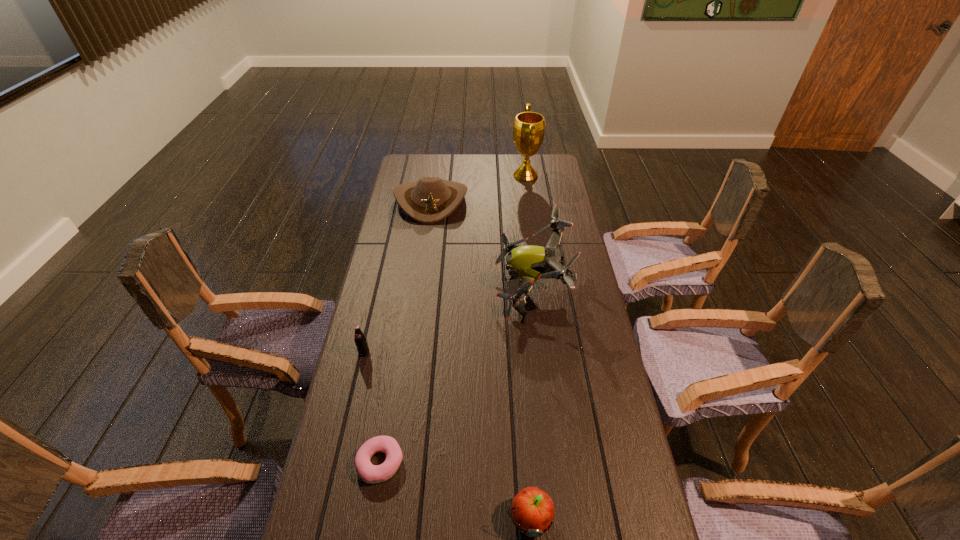
You are a GUI agent. You are given a task and a screenshot of the screen. Output one action in this format:
    pyautogui.click(x=<x>, y=<y>)
    Task: Click on the free region located on the front-facing side of the third farthest object
    
    Given the screenshot: What is the action you would take?
    coord(472,287)

The height and width of the screenshot is (540, 960). I want to click on vacant space located 0.370m on the front-facing side of the third farthest object, so click(x=389, y=287).

Find the location of a particular element. This screenshot has height=540, width=960. vacant space located on the front-facing side of the third farthest object is located at coordinates (426, 287).

The width and height of the screenshot is (960, 540). What are the coordinates of `free location located with a star on the front of the cowboy hat` in the screenshot? It's located at (421, 277).

The height and width of the screenshot is (540, 960). I want to click on vacant space located 0.400m on the front label of the pop, so click(331, 497).

I want to click on free location located on the back of the shortest object, so click(x=395, y=377).

You are a GUI agent. You are given a task and a screenshot of the screen. Output one action in this format:
    pyautogui.click(x=<x>, y=<y>)
    Task: Click on the award that is at the far edge
    
    Given the screenshot: What is the action you would take?
    pyautogui.click(x=529, y=127)

You are a GUI agent. You are given a task and a screenshot of the screen. Output one action in this format:
    pyautogui.click(x=<x>, y=<y>)
    Task: Click on the cowboy hat that is positioned at the far edge
    The image size is (960, 540).
    Given the screenshot: What is the action you would take?
    pyautogui.click(x=430, y=200)

Locate an element on the screen. The height and width of the screenshot is (540, 960). cowboy hat present at the left edge is located at coordinates (430, 200).

The width and height of the screenshot is (960, 540). In order to click on pop present at the left edge in this screenshot , I will do `click(360, 340)`.